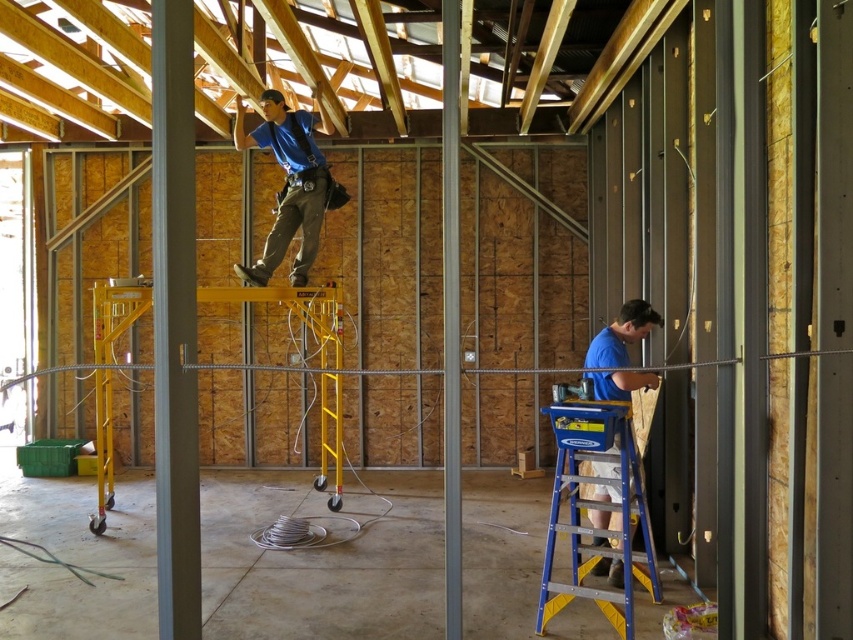
Which of these two, yellow metallic ladder at center or blue matte shirt at lower right, stands taller?

With more height is yellow metallic ladder at center.

Which is behind, point (326, 429) or point (606, 570)?

The point (326, 429) is more distant.

Is point (309, 369) behind point (625, 385)?

That is False.

I want to click on yellow metallic ladder at center, so click(305, 368).

Can you confirm if yellow metallic ladder at center is thinner than blue/yellow plastic ladder at lower right?

No.

Does yellow metallic ladder at center appear over blue/yellow plastic ladder at lower right?

Yes.

Is point (265, 369) in front of point (579, 440)?

No.

At what (x,y) coordinates should I click in order to perform the action: click on yellow metallic ladder at center. Please return your answer as a coordinate pair (x, y). The image size is (853, 640). Looking at the image, I should click on (305, 368).

Does yellow metallic ladder at center have a smaller size compared to blue fabric construction worker at upper center?

Incorrect, yellow metallic ladder at center is not smaller in size than blue fabric construction worker at upper center.

In the scene shown: Does yellow metallic ladder at center have a greater width compared to blue fabric construction worker at upper center?

Indeed, yellow metallic ladder at center has a greater width compared to blue fabric construction worker at upper center.

What do you see at coordinates (305, 368) in the screenshot? This screenshot has width=853, height=640. I see `yellow metallic ladder at center` at bounding box center [305, 368].

Where is `yellow metallic ladder at center`? The height and width of the screenshot is (640, 853). yellow metallic ladder at center is located at coordinates (305, 368).